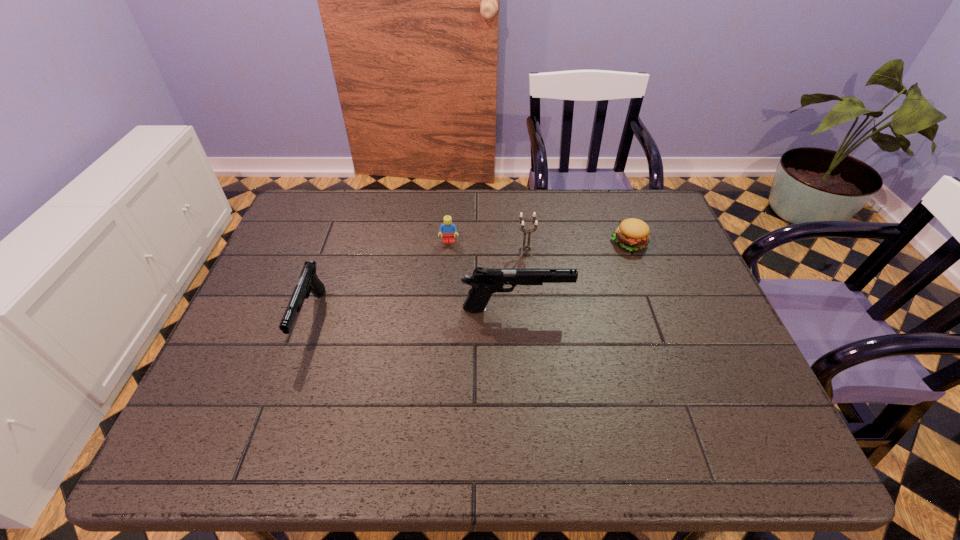
I want to click on free space that satisfies the following two spatial constraints: 1. on the front side of the rightmost object; 2. at the aiming end of the taller gun, so click(x=654, y=309).

Find the location of a particular element. This screenshot has width=960, height=540. free space that satisfies the following two spatial constraints: 1. on the face of the rightmost object; 2. on the right side of the second object from left to right is located at coordinates (449, 242).

Find the location of a particular element. Image resolution: width=960 pixels, height=540 pixels. free point that satisfies the following two spatial constraints: 1. on the face of the fourth tallest object; 2. on the right side of the candle holder is located at coordinates (448, 253).